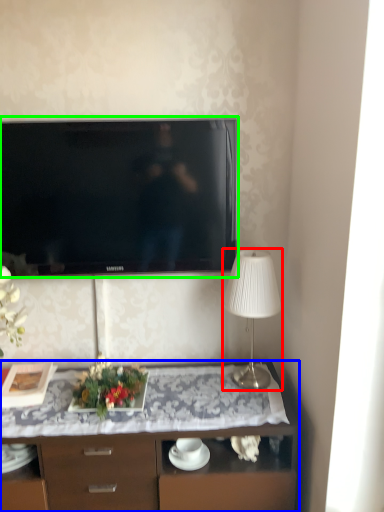
Question: Which is nearer to the lamp (highlighted by a red box)? desk (highlighted by a blue box) or television (highlighted by a green box).

Choices:
 (A) desk
 (B) television

Answer: (A)